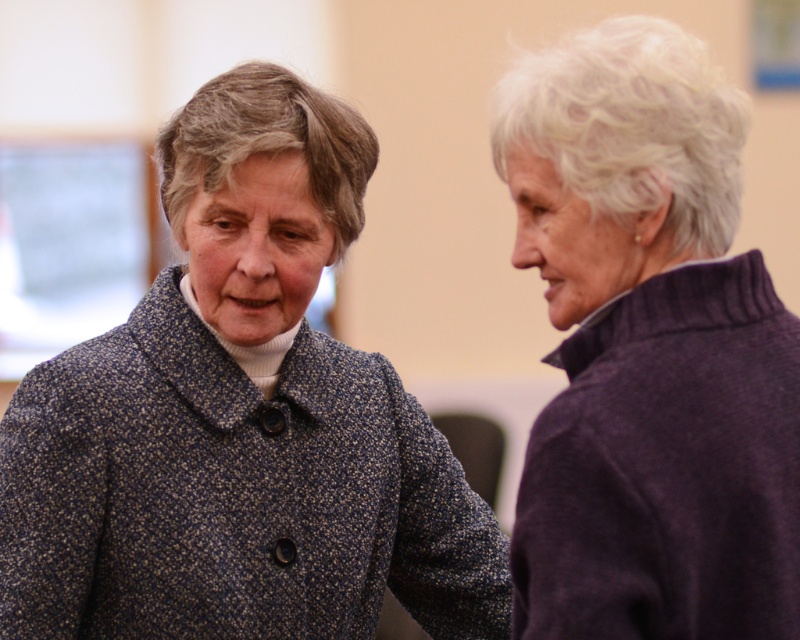
Question: Considering the relative positions of floral-patterned fabric coat at left and purple wool sweater at right in the image provided, where is floral-patterned fabric coat at left located with respect to purple wool sweater at right?

Choices:
 (A) below
 (B) above

Answer: (A)

Question: Does floral-patterned fabric coat at left have a larger size compared to purple wool sweater at right?

Choices:
 (A) yes
 (B) no

Answer: (A)

Question: Which point is farther to the camera?

Choices:
 (A) purple wool sweater at right
 (B) floral-patterned fabric coat at left

Answer: (B)

Question: Can you confirm if floral-patterned fabric coat at left is thinner than purple wool sweater at right?

Choices:
 (A) no
 (B) yes

Answer: (A)

Question: Which point appears farthest from the camera in this image?

Choices:
 (A) click(124, 464)
 (B) click(772, 611)

Answer: (A)

Question: Which object is farther from the camera taking this photo?

Choices:
 (A) floral-patterned fabric coat at left
 (B) purple wool sweater at right

Answer: (A)